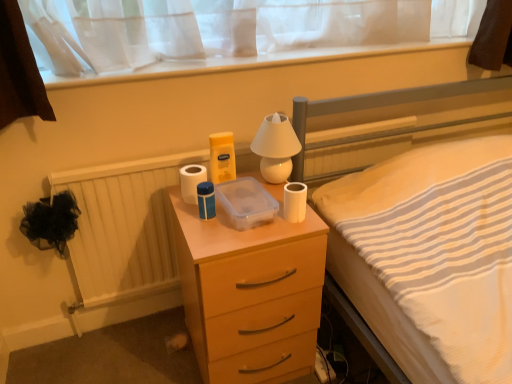
I want to click on vacant area that is in front of white matte toilet paper at center, positioned as the first toilet paper in left-to-right order, so click(x=202, y=225).